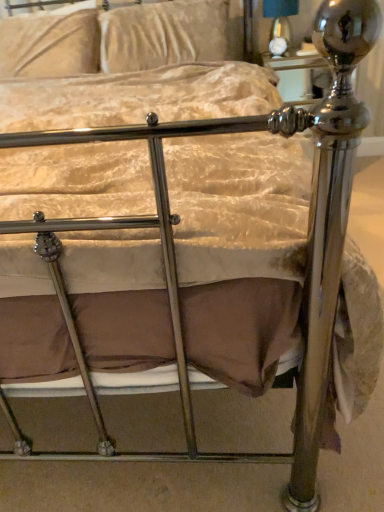
Question: Is velvet beige pillow at upper left, which appears as the first pillow when viewed from the left, far from velvet beige pillow at upper center, which is the first pillow in right-to-left order?

Choices:
 (A) no
 (B) yes

Answer: (A)

Question: Considering the relative sizes of velvet beige pillow at upper left, which appears as the first pillow when viewed from the left, and velvet beige pillow at upper center, which is the first pillow in right-to-left order, in the image provided, is velvet beige pillow at upper left, which appears as the first pillow when viewed from the left, smaller than velvet beige pillow at upper center, which is the first pillow in right-to-left order,?

Choices:
 (A) no
 (B) yes

Answer: (A)

Question: Is the position of velvet beige pillow at upper left, the second pillow viewed from the right, more distant than that of velvet beige pillow at upper center, which is the first pillow in right-to-left order?

Choices:
 (A) yes
 (B) no

Answer: (A)

Question: Is velvet beige pillow at upper center, which is the first pillow in right-to-left order, completely or partially inside velvet beige pillow at upper left, which appears as the first pillow when viewed from the left?

Choices:
 (A) yes
 (B) no

Answer: (B)

Question: Can you confirm if velvet beige pillow at upper left, which appears as the first pillow when viewed from the left, is taller than velvet beige pillow at upper center, which is the first pillow in right-to-left order?

Choices:
 (A) yes
 (B) no

Answer: (A)

Question: Does velvet beige pillow at upper left, the second pillow viewed from the right, have a lesser width compared to velvet beige pillow at upper center, the 2th pillow positioned from the left?

Choices:
 (A) no
 (B) yes

Answer: (A)

Question: Is velvet beige pillow at upper left, which appears as the first pillow when viewed from the left, behind matte black lampshade at upper center?

Choices:
 (A) no
 (B) yes

Answer: (A)

Question: Considering the relative sizes of velvet beige pillow at upper left, which appears as the first pillow when viewed from the left, and matte black lampshade at upper center in the image provided, is velvet beige pillow at upper left, which appears as the first pillow when viewed from the left, thinner than matte black lampshade at upper center?

Choices:
 (A) yes
 (B) no

Answer: (B)

Question: Are velvet beige pillow at upper left, the second pillow viewed from the right, and matte black lampshade at upper center beside each other?

Choices:
 (A) yes
 (B) no

Answer: (B)

Question: Is velvet beige pillow at upper left, the second pillow viewed from the right, closer to camera compared to matte black lampshade at upper center?

Choices:
 (A) yes
 (B) no

Answer: (A)

Question: Are velvet beige pillow at upper left, which appears as the first pillow when viewed from the left, and matte black lampshade at upper center located far from each other?

Choices:
 (A) yes
 (B) no

Answer: (A)

Question: From the image's perspective, does velvet beige pillow at upper left, which appears as the first pillow when viewed from the left, appear lower than matte black lampshade at upper center?

Choices:
 (A) yes
 (B) no

Answer: (A)

Question: Does matte black lampshade at upper center touch velvet beige pillow at upper center, the 2th pillow positioned from the left?

Choices:
 (A) no
 (B) yes

Answer: (A)